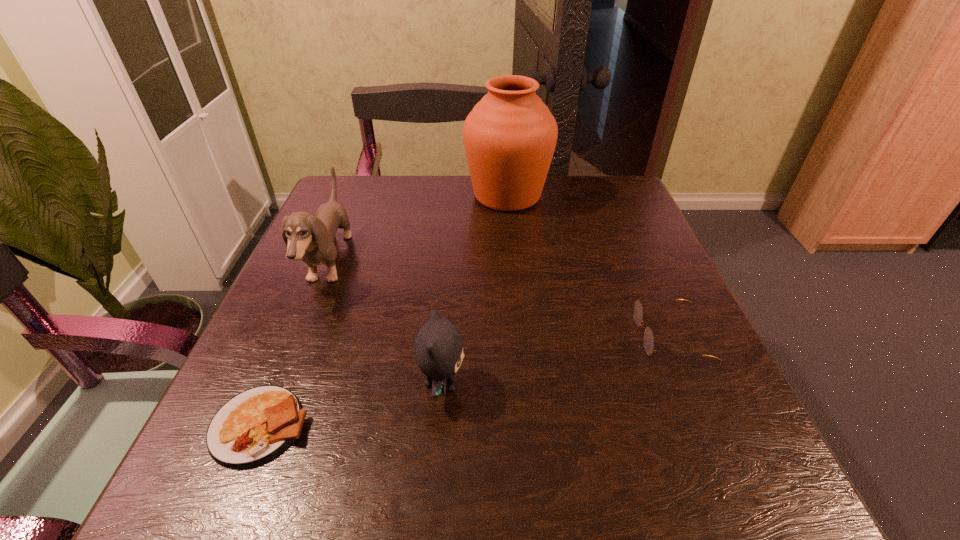
Where is `vacant area that lies between the kitten and the omelet`? vacant area that lies between the kitten and the omelet is located at coordinates (351, 404).

You are a GUI agent. You are given a task and a screenshot of the screen. Output one action in this format:
    pyautogui.click(x=<x>, y=<y>)
    Task: Click on the empty space between the fourth shortest object and the tallest object
    Image resolution: width=960 pixels, height=540 pixels.
    Given the screenshot: What is the action you would take?
    pyautogui.click(x=419, y=229)

At what (x,y) coordinates should I click in order to perform the action: click on vacant area that lies between the urn and the shortest object. Please return your answer as a coordinate pair (x, y). The image size is (960, 540). Looking at the image, I should click on 384,310.

You are a GUI agent. You are given a task and a screenshot of the screen. Output one action in this format:
    pyautogui.click(x=<x>, y=<y>)
    Task: Click on the empty space that is in between the kitten and the fourth shortest object
    This screenshot has height=540, width=960.
    Given the screenshot: What is the action you would take?
    pyautogui.click(x=386, y=323)

In order to click on free area in between the kitten and the fourth shortest object in this screenshot , I will do `click(386, 323)`.

The image size is (960, 540). I want to click on free space between the omelet and the kitten, so click(351, 404).

Identify the location of free spot between the urn and the shortest object. (384, 310).

Locate an element on the screen. The width and height of the screenshot is (960, 540). unoccupied area between the spectacles and the urn is located at coordinates (588, 266).

Choose which object is the second nearest neighbor to the third shortest object. Please provide its 2D coordinates. Your answer should be formatted as a tuple, i.e. [(x, y)], where the tuple contains the x and y coordinates of a point satisfying the conditions above.

[(311, 238)]

At what (x,y) coordinates should I click in order to perform the action: click on object that is the third nearest to the second tallest object. Please return your answer as a coordinate pair (x, y). The width and height of the screenshot is (960, 540). Looking at the image, I should click on (510, 135).